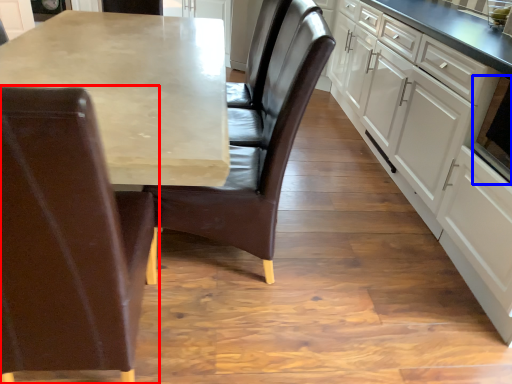
Question: Which point is further to the camera, chair (highlighted by a red box) or appliance (highlighted by a blue box)?

Choices:
 (A) chair
 (B) appliance

Answer: (B)